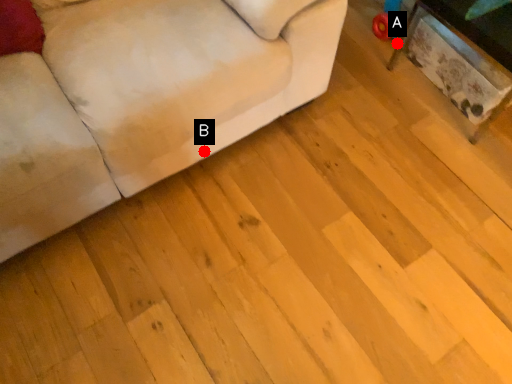
Question: Two points are circled on the image, labeled by A and B beside each circle. Which point is closer to the camera?

Choices:
 (A) A is closer
 (B) B is closer

Answer: (B)